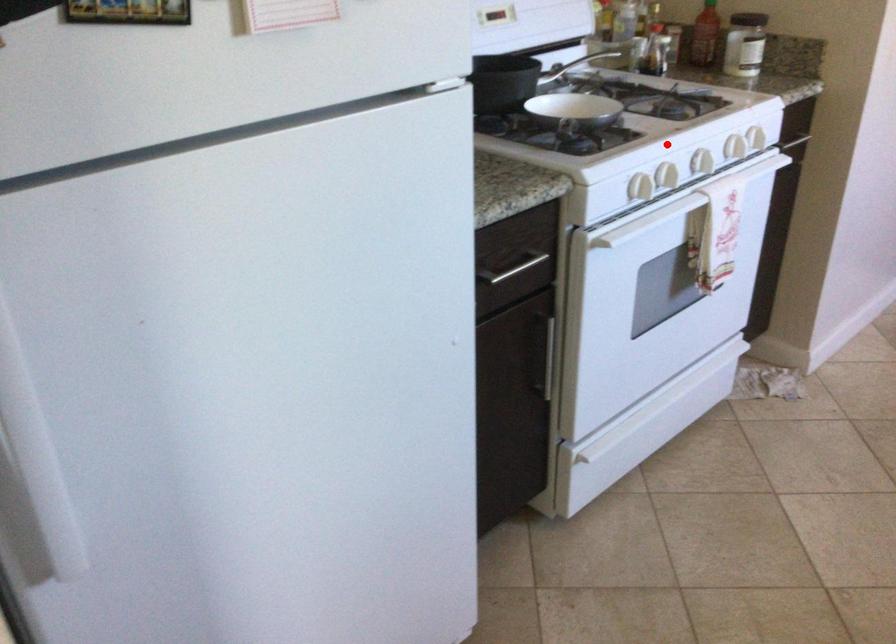
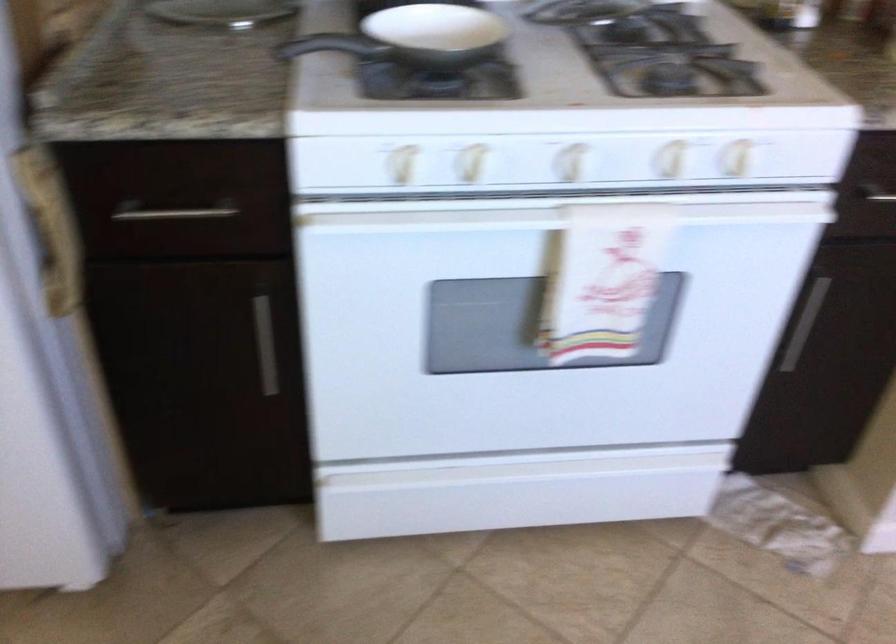
Question: I am providing you with two images of the same scene from different viewpoints. A red point is shown in image1. For the corresponding object point in image2, is it positioned nearer or farther from the camera?

Choices:
 (A) Nearer
 (B) Farther

Answer: (A)